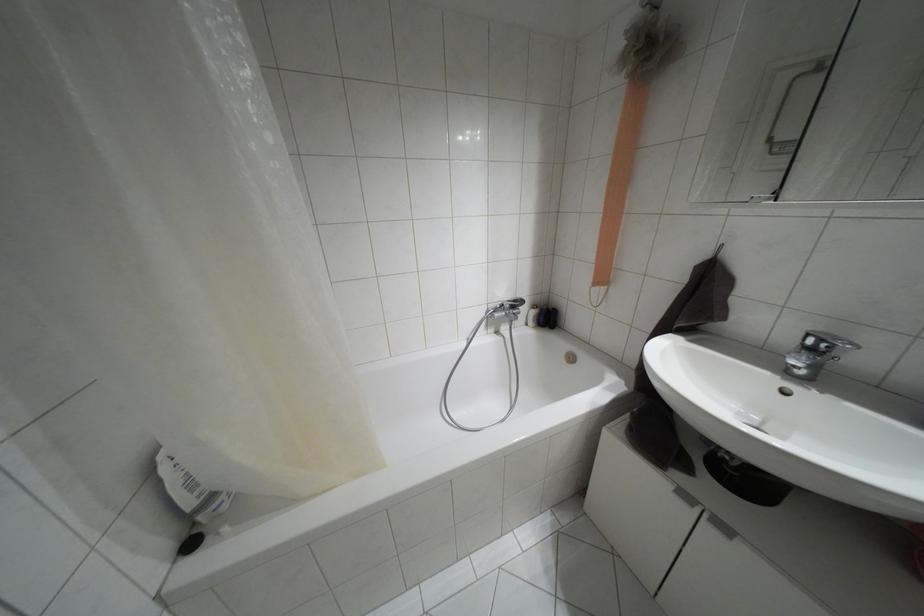
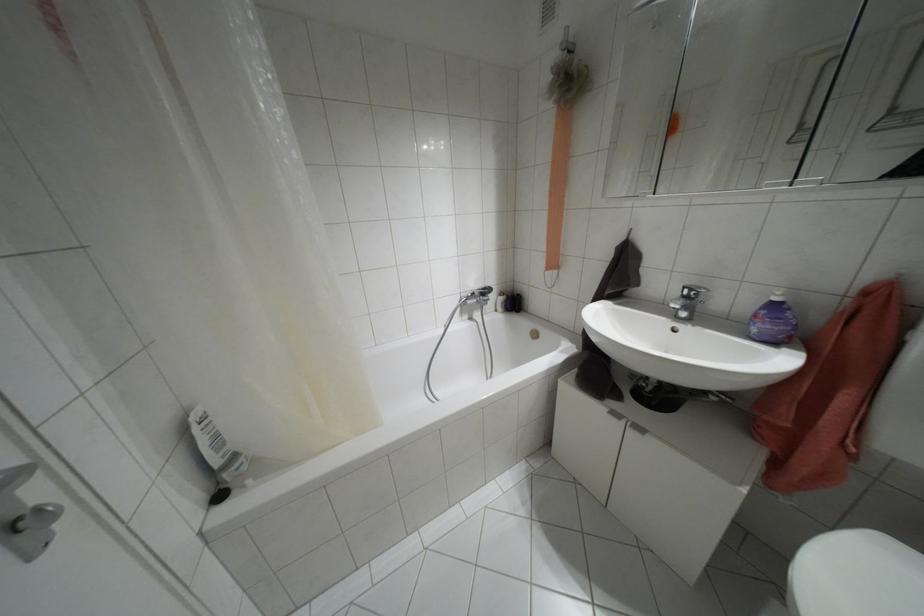
Question: Based on the continuous images, in which direction is the camera rotating? Reply with the corresponding letter.

Choices:
 (A) Left
 (B) Right
 (C) Up
 (D) Down

Answer: (B)